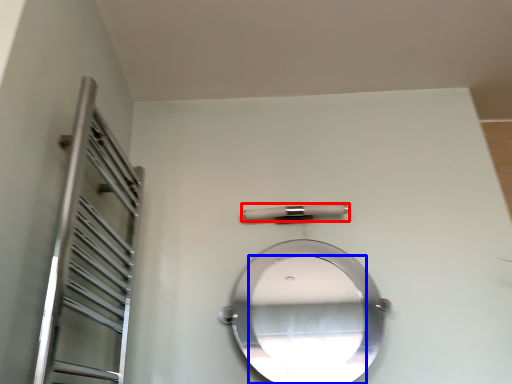
Question: Among these objects, which one is nearest to the camera, door handle (highlighted by a red box) or mirror (highlighted by a blue box)?

Choices:
 (A) door handle
 (B) mirror

Answer: (B)